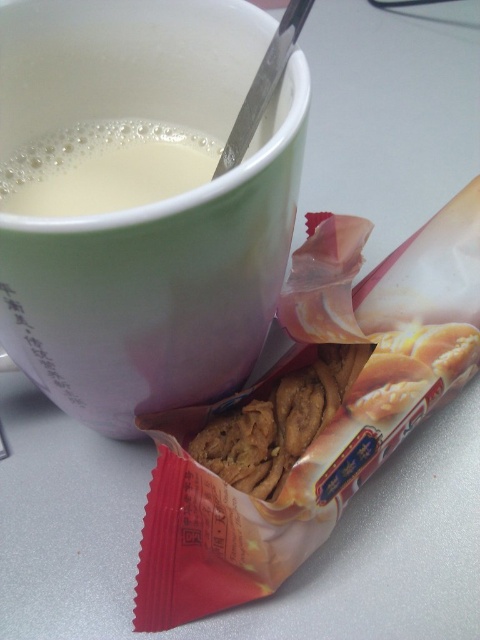
You are setting up a small breakfast nook and want to place the matte ceramic mug at upper center and the white creamy liquid at upper left on a shelf. The shelf has limited space. Which object should you place first to ensure both fit?

The matte ceramic mug at upper center is bigger than the white creamy liquid at upper left, so you should place the matte ceramic mug at upper center first to ensure both fit on the shelf.

From the picture: You are a delivery robot with a 30 cm wide package. You need to place it between the matte ceramic mug at upper center and the packet of cookies. Is there enough space?

The distance between the matte ceramic mug at upper center and the packet of cookies is 55.66 centimeters. Since the package is 30 cm wide, there is sufficient space to place it between them.

Based on the photo, you are setting up a breakfast tray and need to place the matte ceramic mug at upper center and the white creamy liquid at upper left. According to the image, which object should be placed higher to ensure the liquid stays in the mug?

The matte ceramic mug at upper center should be placed higher than the white creamy liquid at upper left because the liquid needs to be above the mug to pour into it, but according to the description, the mug is positioned under the liquid, so to replicate that setup, the liquid should be higher than the mug. Wait, there might be a misunderstanding here. Let me clarify. The description says the matte ceramic mug is positioned under the white creamy liquid. That means the liquid is above the mug. So to setit